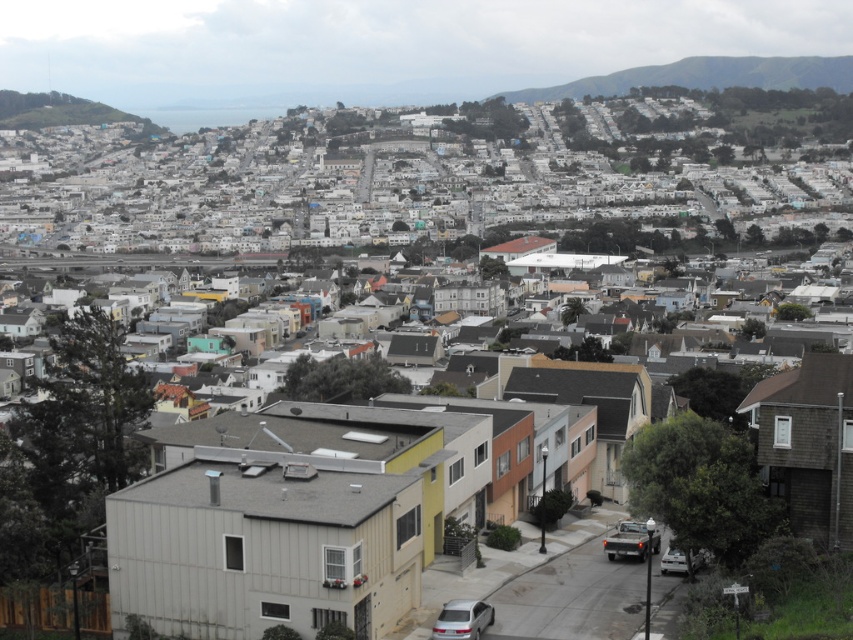
Which is in front, point (567, 92) or point (672, 556)?

Positioned in front is point (672, 556).

Image resolution: width=853 pixels, height=640 pixels. Describe the element at coordinates (704, 76) in the screenshot. I see `green grassy hillside at upper center` at that location.

Find the location of a particular element. green grassy hillside at upper center is located at coordinates pos(704,76).

Is point (462, 618) positioned after point (695, 554)?

No.

Does satin silver sedan at lower center appear over silver metallic car at lower right?

No.

Where is `satin silver sedan at lower center`? satin silver sedan at lower center is located at coordinates (462, 620).

The image size is (853, 640). Identify the location of satin silver sedan at lower center. (462, 620).

Is shiny silver car at lower center to the left of silver metallic car at lower right from the viewer's perspective?

Yes, shiny silver car at lower center is to the left of silver metallic car at lower right.

Can you confirm if shiny silver car at lower center is positioned below silver metallic car at lower right?

Incorrect, shiny silver car at lower center is not positioned below silver metallic car at lower right.

Which is behind, point (642, 528) or point (701, 561)?

The point (642, 528) is behind.

The width and height of the screenshot is (853, 640). In order to click on shiny silver car at lower center in this screenshot , I will do `click(631, 540)`.